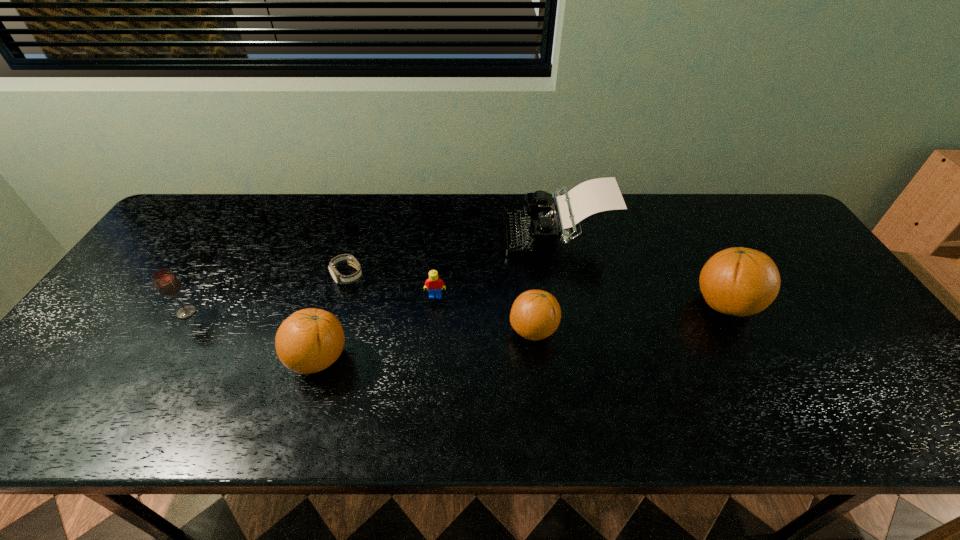
Locate an element on the screen. The width and height of the screenshot is (960, 540). free space between the rightmost object and the sixth tallest object is located at coordinates (581, 300).

The width and height of the screenshot is (960, 540). What are the coordinates of `empty space between the watch and the fourth object from right to left` in the screenshot? It's located at (392, 286).

I want to click on free point between the rightmost orange and the second orange from left to right, so click(630, 318).

You are a GUI agent. You are given a task and a screenshot of the screen. Output one action in this format:
    pyautogui.click(x=<x>, y=<y>)
    Task: Click on the free space between the leftmost object and the rightmost object
    
    Given the screenshot: What is the action you would take?
    pyautogui.click(x=456, y=308)

Where is `object identified as the fourth closest to the shortest object`? The height and width of the screenshot is (540, 960). object identified as the fourth closest to the shortest object is located at coordinates (533, 232).

Choose which object is the second nearest neighbor to the farthest object. Please provide its 2D coordinates. Your answer should be formatted as a tuple, i.e. [(x, y)], where the tuple contains the x and y coordinates of a point satisfying the conditions above.

[(535, 314)]

Point out which orange is positioned as the nearest to the fourth object from left to right. Please provide its 2D coordinates. Your answer should be formatted as a tuple, i.e. [(x, y)], where the tuple contains the x and y coordinates of a point satisfying the conditions above.

[(535, 314)]

This screenshot has height=540, width=960. Identify the location of orange that is the third closest to the watch. (738, 281).

What are the coordinates of `free space that satisfies the following two spatial constraints: 1. on the keys of the typewriter; 2. on the front side of the leftmost object` in the screenshot? It's located at (571, 313).

Where is `vacant region that satisfies the following two spatial constraints: 1. on the keys of the typewriter; 2. on the face of the second shortest object`? Image resolution: width=960 pixels, height=540 pixels. vacant region that satisfies the following two spatial constraints: 1. on the keys of the typewriter; 2. on the face of the second shortest object is located at coordinates (568, 296).